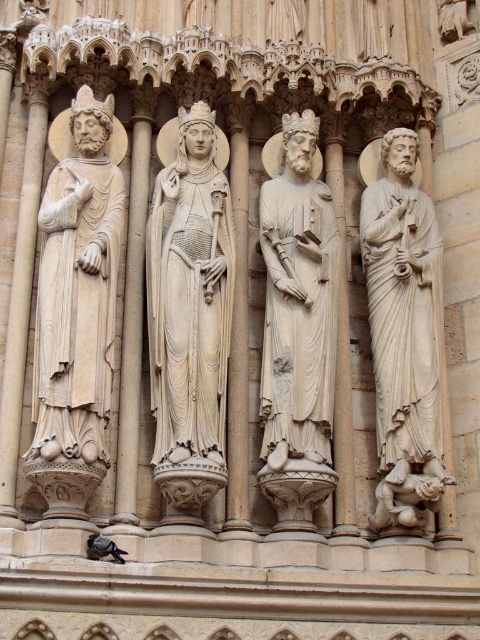
Question: Which point is farther from the camera taking this photo?

Choices:
 (A) (197, 200)
 (B) (375, 422)
 (C) (4, 452)
 (D) (61, 406)

Answer: (B)

Question: Which object appears closest to the camera in this image?

Choices:
 (A) white stone statue at center
 (B) white marble statue at center
 (C) white marble statue at right
 (D) white stone pillar at left

Answer: (D)

Question: Can you confirm if white marble statue at center is positioned to the right of white stone pillar at left?

Choices:
 (A) no
 (B) yes

Answer: (B)

Question: Can you confirm if white stone statue at center is positioned to the right of white stone pillar at left?

Choices:
 (A) yes
 (B) no

Answer: (A)

Question: Can you confirm if beige stone statue at left is positioned above white stone pillar at left?

Choices:
 (A) yes
 (B) no

Answer: (A)

Question: Which is nearer to the white stone pillar at left?

Choices:
 (A) white stone statue at center
 (B) beige stone statue at left

Answer: (B)